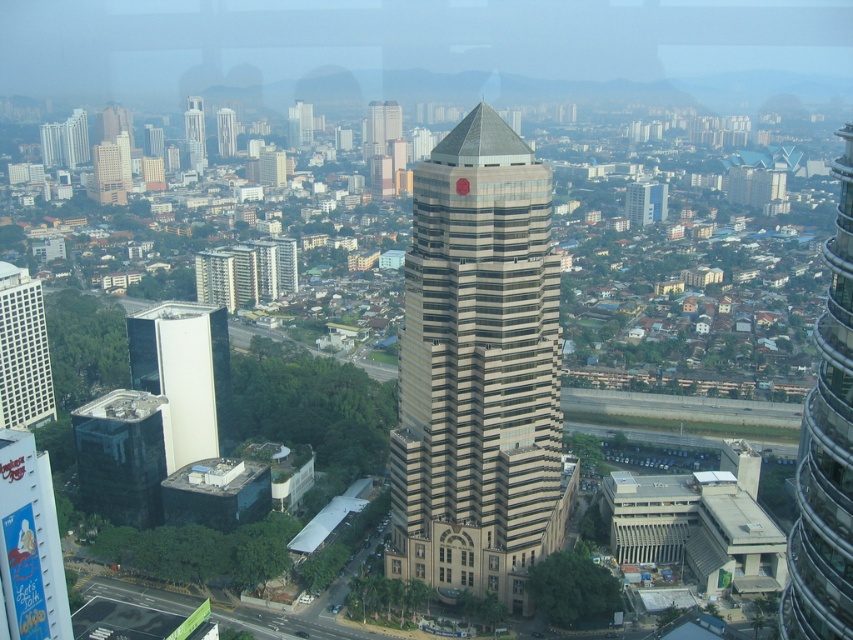
You are standing on a balcony overlooking the city and see the white glass building at left and the matte beige building at left. Which building is closer to the ground?

The white glass building at left is below the matte beige building at left, so it is closer to the ground.

You are an architect planning to install a large billboard between the white glass building at left and the matte beige building at left. The billboard requires a minimum of 40 meters of space between the two buildings to be installed safely. Based on the scene, can the billboard be installed?

The white glass building at left and matte beige building at left are 40.94 meters apart, which exceeds the minimum requirement of 40 meters. Therefore, the billboard can be safely installed between them.